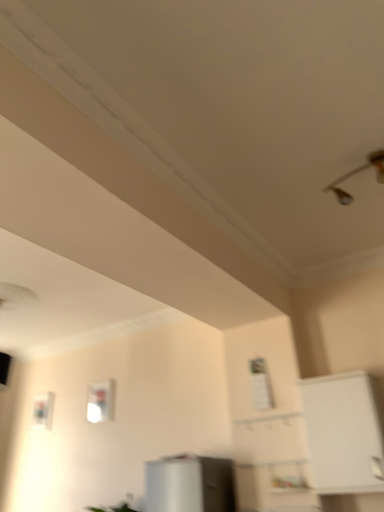
Question: Relative to transparent glass window at center, is metallic silver light fixture at upper right in front or behind?

Choices:
 (A) behind
 (B) front

Answer: (B)

Question: In terms of height, does metallic silver light fixture at upper right look taller or shorter compared to transparent glass window at center?

Choices:
 (A) tall
 (B) short

Answer: (B)

Question: Which of these objects is positioned closest to the metallic silver light fixture at upper right?

Choices:
 (A) white matte cabinet at right
 (B) transparent glass window at center

Answer: (A)

Question: Which object is the closest to the metallic silver light fixture at upper right?

Choices:
 (A) transparent glass window at center
 (B) white matte cabinet at right

Answer: (B)